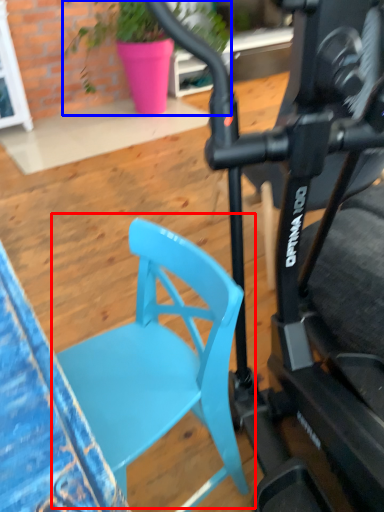
Question: Among these objects, which one is farthest to the camera, chair (highlighted by a red box) or houseplant (highlighted by a blue box)?

Choices:
 (A) chair
 (B) houseplant

Answer: (B)